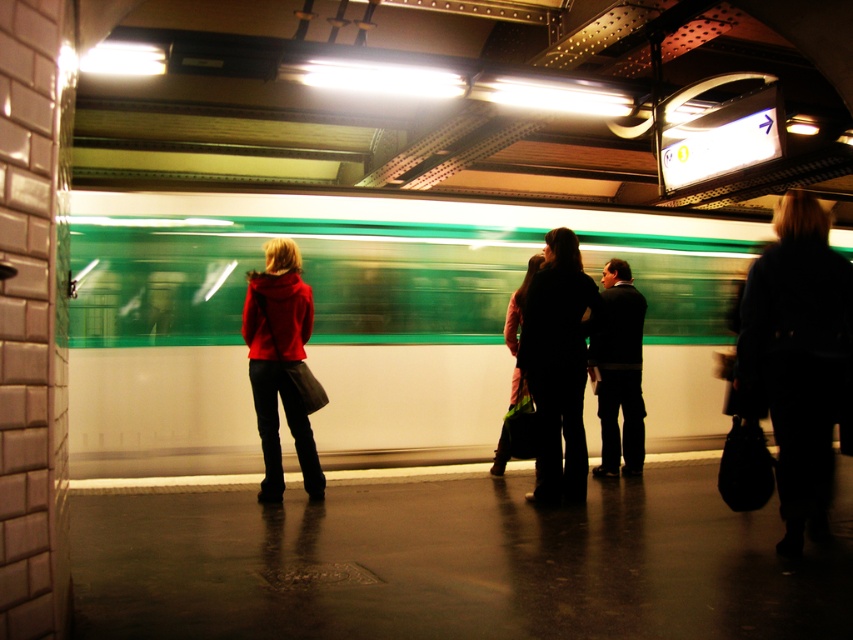
You are standing on the subway platform and want to take a photo of the green glossy train at center. Where should you position yourself to capture it in the best possible frame?

To capture the green glossy train at center in the best possible frame, position yourself at the center of the platform, aligned with the train at coordinates point (360, 323).

You are a photographer trying to capture the entire scene of the subway station. You notice the green glossy train at center and the matte red jacket at left. Which object is narrower in width?

The green glossy train at center has a lesser width compared to the matte red jacket at left, so the green glossy train at center is narrower in width.

Consider the image. You are a photographer trying to capture a photo of the green glossy train at center and the dark blue coat at right. Which object should you focus on first if you want to include both in your shot without cropping?

The green glossy train at center occupies less space than the dark blue coat at right, so you should focus on the dark blue coat at right first to ensure it fits within the frame.